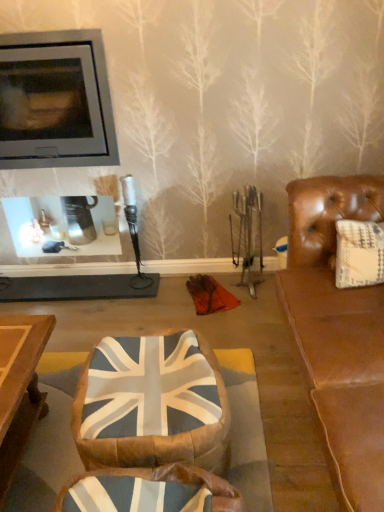
Locate an element on the screen. This screenshot has width=384, height=512. matte gray fireplace at upper left is located at coordinates (60, 102).

Describe the element at coordinates (60, 102) in the screenshot. This screenshot has width=384, height=512. I see `matte gray fireplace at upper left` at that location.

What are the coordinates of `union jack fabric bean bag at center` in the screenshot? It's located at (152, 404).

This screenshot has width=384, height=512. Describe the element at coordinates (152, 404) in the screenshot. I see `union jack fabric bean bag at center` at that location.

The width and height of the screenshot is (384, 512). I want to click on matte gray fireplace at upper left, so click(x=60, y=102).

Which object is positioned more to the right, union jack fabric bean bag at center or matte gray fireplace at upper left?

union jack fabric bean bag at center.

Is union jack fabric bean bag at center in front of or behind matte gray fireplace at upper left in the image?

Clearly, union jack fabric bean bag at center is in front of matte gray fireplace at upper left.

Which is less distant, [176,422] or [86,99]?

Point [176,422] is closer to the camera than point [86,99].

From the image's perspective, is union jack fabric bean bag at center above or below matte gray fireplace at upper left?

union jack fabric bean bag at center is below matte gray fireplace at upper left.

From a real-world perspective, is union jack fabric bean bag at center below matte gray fireplace at upper left?

Yes, from a real-world perspective, union jack fabric bean bag at center is beneath matte gray fireplace at upper left.

Is union jack fabric bean bag at center thinner than matte gray fireplace at upper left?

In fact, union jack fabric bean bag at center might be wider than matte gray fireplace at upper left.

Is union jack fabric bean bag at center taller or shorter than matte gray fireplace at upper left?

Considering their sizes, union jack fabric bean bag at center has less height than matte gray fireplace at upper left.

Between union jack fabric bean bag at center and matte gray fireplace at upper left, which one has smaller size?

With smaller size is union jack fabric bean bag at center.

Which is correct: union jack fabric bean bag at center is inside matte gray fireplace at upper left, or outside of it?

union jack fabric bean bag at center is located beyond the bounds of matte gray fireplace at upper left.

Would you say union jack fabric bean bag at center is a long distance from matte gray fireplace at upper left?

Absolutely, union jack fabric bean bag at center is distant from matte gray fireplace at upper left.

Is union jack fabric bean bag at center facing away from matte gray fireplace at upper left?

union jack fabric bean bag at center is not turned away from matte gray fireplace at upper left.

Can you tell me how much union jack fabric bean bag at center and matte gray fireplace at upper left differ in facing direction?

The facing directions of union jack fabric bean bag at center and matte gray fireplace at upper left are 79.1 degrees apart.

Locate an element on the screen. Image resolution: width=384 pixels, height=512 pixels. bean bag chair directly beneath the matte gray fireplace at upper left (from a real-world perspective) is located at coordinates (152, 404).

Considering the positions of objects matte gray fireplace at upper left and union jack fabric bean bag at center in the image provided, who is more to the right, matte gray fireplace at upper left or union jack fabric bean bag at center?

union jack fabric bean bag at center is more to the right.

Considering their positions, is matte gray fireplace at upper left located in front of or behind union jack fabric bean bag at center?

matte gray fireplace at upper left is positioned farther from the viewer than union jack fabric bean bag at center.

Which is less distant, (25,57) or (93,460)?

Clearly, point (25,57) is more distant from the camera than point (93,460).

Based on the photo, from the image's perspective, which one is positioned lower, matte gray fireplace at upper left or union jack fabric bean bag at center?

From the image's view, union jack fabric bean bag at center is below.

From a real-world perspective, which object stands above the other?

From a 3D spatial view, matte gray fireplace at upper left is above.

Between matte gray fireplace at upper left and union jack fabric bean bag at center, which one has smaller width?

matte gray fireplace at upper left.

In terms of height, does matte gray fireplace at upper left look taller or shorter compared to union jack fabric bean bag at center?

Considering their sizes, matte gray fireplace at upper left has more height than union jack fabric bean bag at center.

Looking at this image, considering the relative sizes of matte gray fireplace at upper left and union jack fabric bean bag at center in the image provided, is matte gray fireplace at upper left bigger than union jack fabric bean bag at center?

Correct, matte gray fireplace at upper left is larger in size than union jack fabric bean bag at center.

Can union jack fabric bean bag at center be found inside matte gray fireplace at upper left?

No, union jack fabric bean bag at center is located outside of matte gray fireplace at upper left.

Is matte gray fireplace at upper left far away from union jack fabric bean bag at center?

Yes.

Is matte gray fireplace at upper left oriented away from union jack fabric bean bag at center?

No, union jack fabric bean bag at center is not at the back of matte gray fireplace at upper left.

What's the angular difference between matte gray fireplace at upper left and union jack fabric bean bag at center's facing directions?

The facing directions of matte gray fireplace at upper left and union jack fabric bean bag at center are 79.1 degrees apart.

This screenshot has width=384, height=512. I want to click on bean bag chair on the right side of matte gray fireplace at upper left, so click(152, 404).

Find the location of a particular element. This screenshot has width=384, height=512. bean bag chair in front of the matte gray fireplace at upper left is located at coordinates (152, 404).

Locate an element on the screen. This screenshot has width=384, height=512. fireplace above the union jack fabric bean bag at center (from a real-world perspective) is located at coordinates pyautogui.click(x=60, y=102).